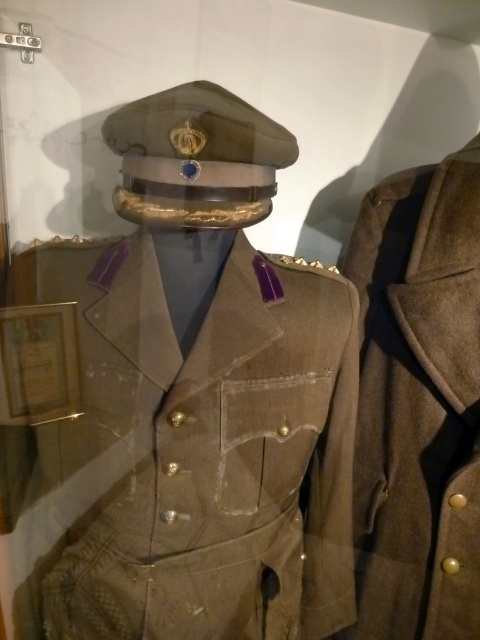
Question: Which object is closer to the camera taking this photo?

Choices:
 (A) matte brown uniform at center
 (B) brown wool coat at right

Answer: (A)

Question: Is matte brown uniform at center wider than brown wool coat at right?

Choices:
 (A) no
 (B) yes

Answer: (B)

Question: Can you confirm if matte brown uniform at center is wider than brown wool coat at right?

Choices:
 (A) no
 (B) yes

Answer: (B)

Question: Among these objects, which one is nearest to the camera?

Choices:
 (A) brown wool coat at right
 (B) matte brown uniform at center

Answer: (B)

Question: Among these points, which one is nearest to the camera?

Choices:
 (A) (393, 618)
 (B) (219, 227)

Answer: (B)

Question: Considering the relative positions of matte brown uniform at center and brown wool coat at right in the image provided, where is matte brown uniform at center located with respect to brown wool coat at right?

Choices:
 (A) right
 (B) left

Answer: (B)